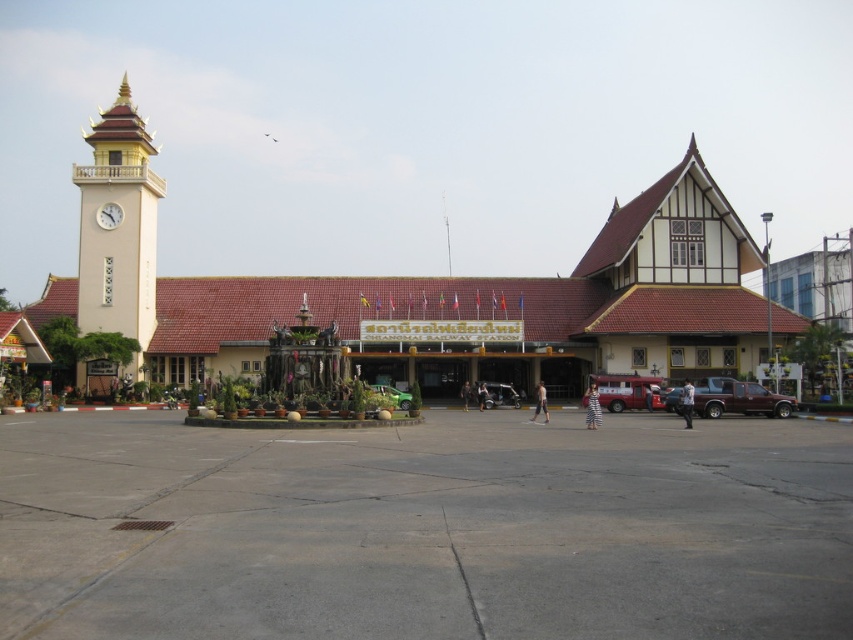
You are standing at the entrance of Chiangmai Railway Station and want to take a photo that includes both the point at coordinates point (718, 403) and point (108, 228). Which point should you focus on to ensure both are in the frame?

You should focus on point (718, 403) because it is closer to the camera, allowing the point (108, 228) to be captured in the background of the photo.

Looking at this image, you are standing at point (x=380, y=392) and want to walk towards the station entrance. Is the point (x=618, y=384) behind you or in front of you relative to your direction of movement?

The point (x=618, y=384) is behind point (x=380, y=392), so when you walk towards the station entrance from point (x=380, y=392), the point (x=618, y=384) will be behind you relative to your direction of movement.

You are standing at the Chiangmai Railway Station and want to take a photo of the clock tower on the left side of the station building. If you are currently at the point marked at coordinate (743, 392), which is 47.46 meters away from you, can you capture the entire clock tower in your shot without moving? Please consider the camera angle and distance.

The point marked at coordinate (743, 392) is 47.46 meters away from you. Since the clock tower is part of the station building on the left side, and you are positioned at this point, you would need to adjust your camera angle to ensure the entire clock tower fits in the frame. However, without knowing the camera sensor size or lens focal length, it is impossible to definitively determine if the entire clock tower can be captured without moving. Consider using a wide angle lens or moving closer for a full,